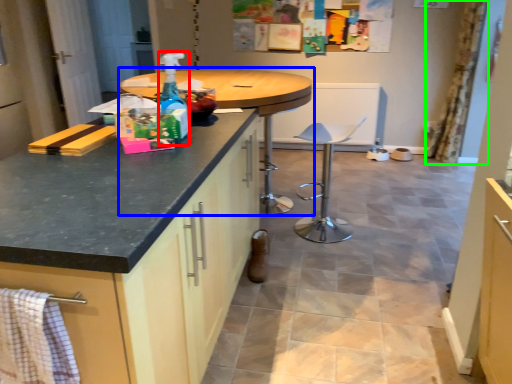
Question: Which object is the closest to the bottle (highlighted by a red box)? Choose among these: table (highlighted by a blue box) or curtain (highlighted by a green box).

Choices:
 (A) table
 (B) curtain

Answer: (A)